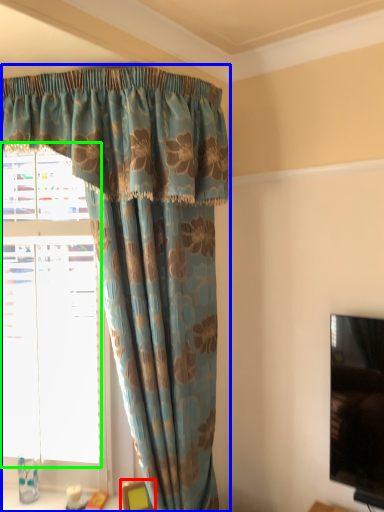
Question: Which object is the farthest from furniture (highlighted by a red box)? Choose among these: curtain (highlighted by a blue box) or bay window (highlighted by a green box).

Choices:
 (A) curtain
 (B) bay window

Answer: (A)